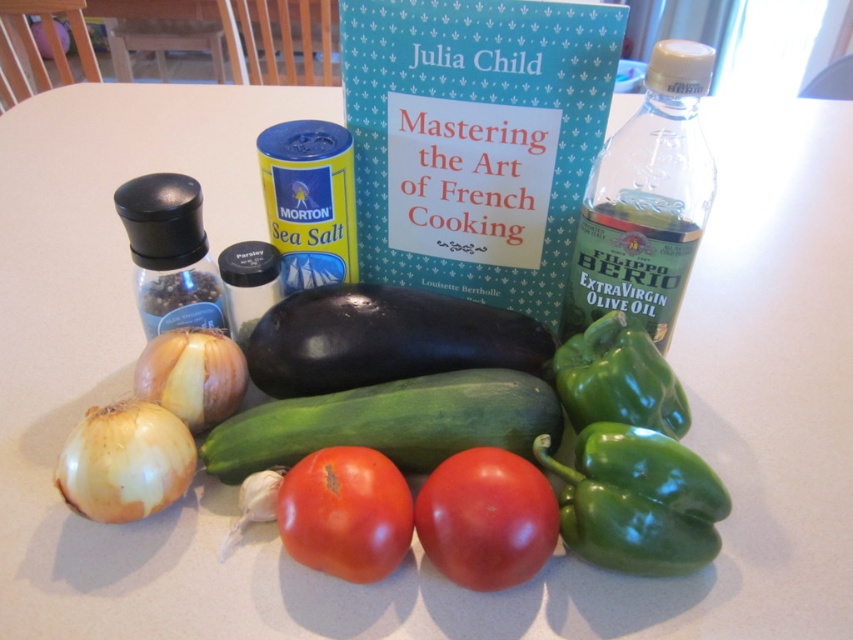
You are a chef preparing a dish and need to reach both the green matte bell pepper at lower right and the shiny red tomato at center. Which ingredient will you touch first if you extend your hand straight ahead?

The green matte bell pepper at lower right is closer to you, so you will touch it first.

You are a chef preparing a dish and need to locate the green matte bell pepper at lower right. Based on the coordinates provided in the scene, where exactly should you look on the table?

The green matte bell pepper at lower right is located at point (637, 500), so you should look there on the table.

Looking at this image, you are preparing a salad and need to choose between the green matte bell pepper at lower right and the shiny red tomato at center. Which one is taller?

The green matte bell pepper at lower right is taller than the shiny red tomato at center.